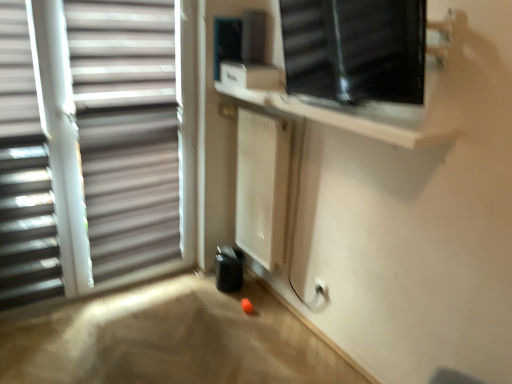
Question: Does white matte radiator at center have a lesser height compared to white matte window blind at left?

Choices:
 (A) no
 (B) yes

Answer: (B)

Question: From the image's perspective, is white matte radiator at center located beneath white matte window blind at left?

Choices:
 (A) no
 (B) yes

Answer: (B)

Question: Can you confirm if white matte radiator at center is positioned to the right of white matte window blind at left?

Choices:
 (A) yes
 (B) no

Answer: (A)

Question: Considering the relative sizes of white matte radiator at center and white matte window blind at left in the image provided, is white matte radiator at center wider than white matte window blind at left?

Choices:
 (A) yes
 (B) no

Answer: (A)

Question: From the image's perspective, is white matte radiator at center on white matte window blind at left?

Choices:
 (A) yes
 (B) no

Answer: (B)

Question: In terms of width, does white matte radiator at center look wider or thinner when compared to white matte window blind at left?

Choices:
 (A) thin
 (B) wide

Answer: (B)

Question: From the image's perspective, is white matte radiator at center above or below white matte window blind at left?

Choices:
 (A) below
 (B) above

Answer: (A)

Question: Looking at the image, does white matte radiator at center seem bigger or smaller compared to white matte window blind at left?

Choices:
 (A) small
 (B) big

Answer: (B)

Question: In the image, is white matte radiator at center positioned in front of or behind white matte window blind at left?

Choices:
 (A) front
 (B) behind

Answer: (B)

Question: From the image's perspective, is white matte window at left, which appears as the first window when viewed from the left, above or below white matte window blind at left?

Choices:
 (A) above
 (B) below

Answer: (A)

Question: Would you say white matte window at left, which is counted as the 2th window, starting from the right, is inside or outside white matte window blind at left?

Choices:
 (A) outside
 (B) inside

Answer: (A)

Question: Visually, is white matte window at left, which appears as the first window when viewed from the left, positioned to the left or to the right of white matte window blind at left?

Choices:
 (A) right
 (B) left

Answer: (A)

Question: From their relative heights in the image, would you say white matte window at left, which appears as the first window when viewed from the left, is taller or shorter than white matte window blind at left?

Choices:
 (A) tall
 (B) short

Answer: (A)

Question: In terms of height, does transparent glass window at upper right, which is counted as the first window, starting from the right, look taller or shorter compared to white matte window blind at left?

Choices:
 (A) tall
 (B) short

Answer: (B)

Question: Does point (372, 6) appear closer or farther from the camera than point (31, 97)?

Choices:
 (A) closer
 (B) farther

Answer: (A)